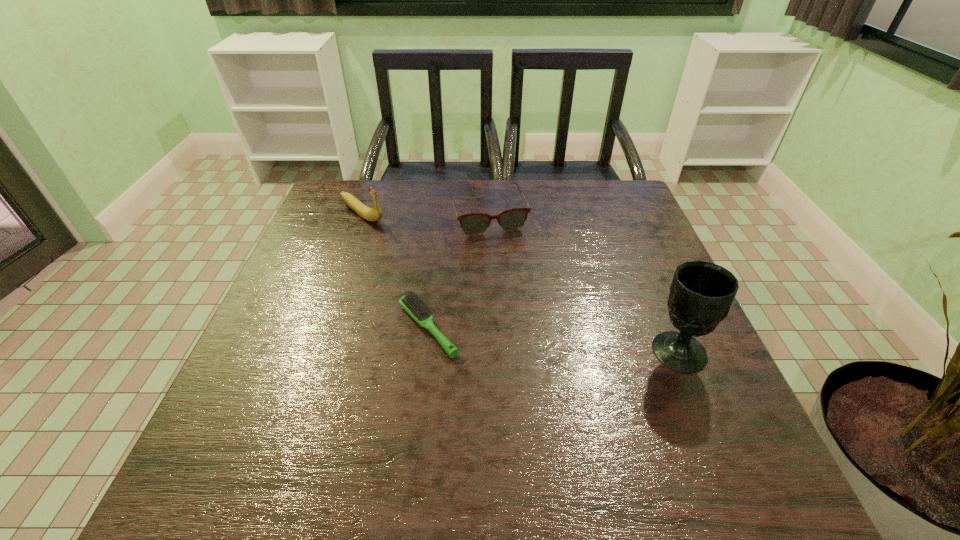
Find the location of a particular element. hairbrush is located at coordinates (411, 303).

At what (x,y) coordinates should I click in order to perform the action: click on the tallest object. Please return your answer as a coordinate pair (x, y). The width and height of the screenshot is (960, 540). Looking at the image, I should click on (701, 294).

Find the location of a particular element. The height and width of the screenshot is (540, 960). the rightmost object is located at coordinates (701, 294).

This screenshot has width=960, height=540. In order to click on the third tallest object in this screenshot , I will do `click(512, 219)`.

Image resolution: width=960 pixels, height=540 pixels. Find the location of `the leftmost object`. the leftmost object is located at coordinates (373, 214).

This screenshot has height=540, width=960. What are the coordinates of `the third shortest object` in the screenshot? It's located at (373, 214).

Locate an element on the screen. vacant region located 0.070m on the back of the hairbrush is located at coordinates (434, 279).

Locate an element on the screen. This screenshot has height=540, width=960. free space located on the back of the tallest object is located at coordinates (653, 291).

The height and width of the screenshot is (540, 960). In order to click on vacant region located 0.050m at the front view of the second shortest object in this screenshot , I will do `click(501, 248)`.

Locate an element on the screen. free location located 0.390m at the front view of the second shortest object is located at coordinates (540, 350).